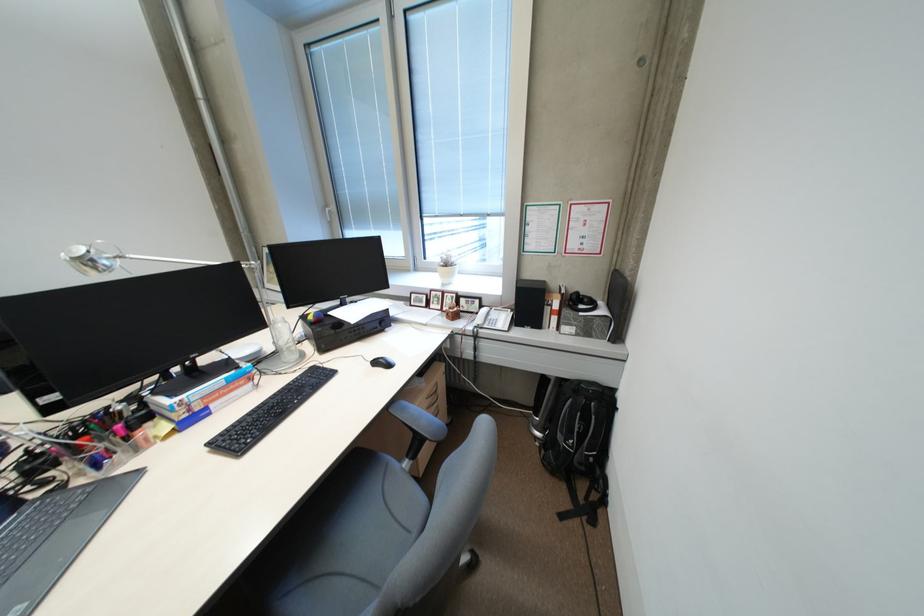
The height and width of the screenshot is (616, 924). I want to click on silver lamp head, so click(x=92, y=257).